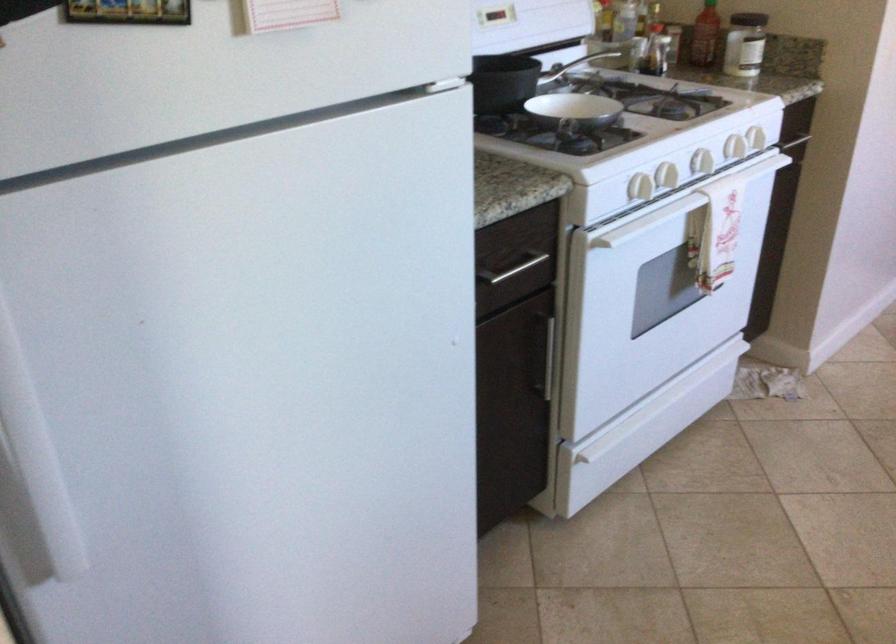
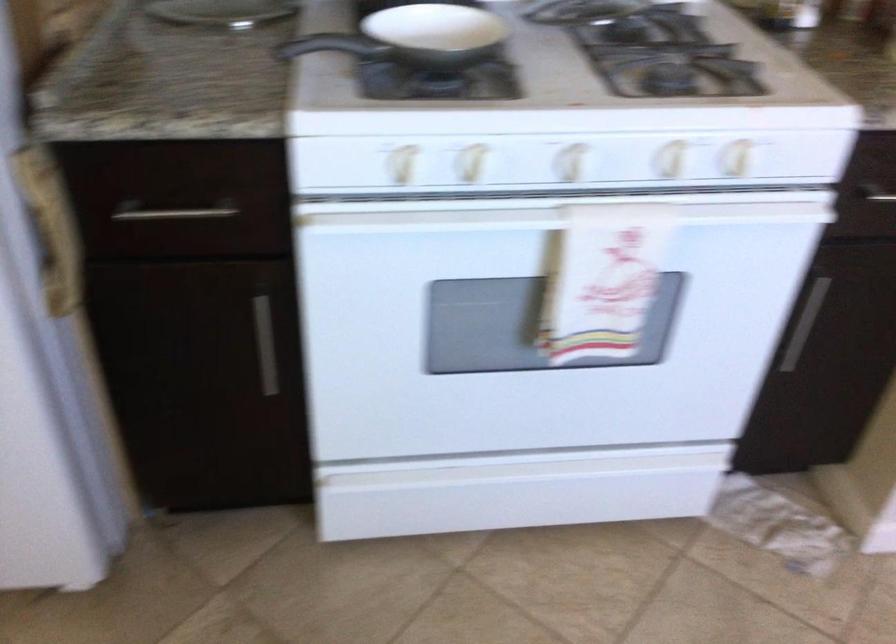
Find the pixel in the second image that matches point 702,165 in the first image.

(550, 218)